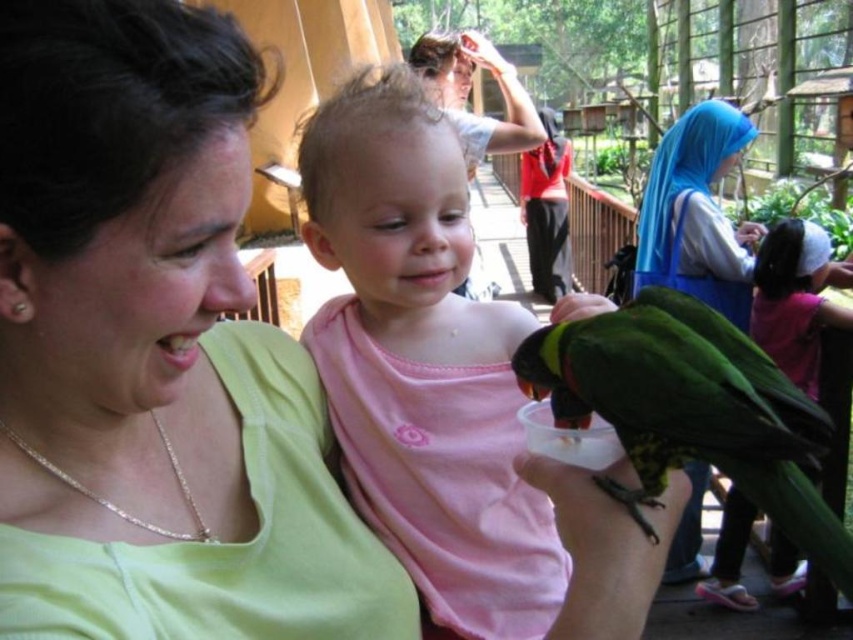
You are a photographer trying to capture a photo of the green matte parrot at lower right. The pink matte shirt at center is blocking your view. Can you estimate if the parrot is shorter than the shirt?

The pink matte shirt at center is taller than green matte parrot at lower right, so yes, the parrot is shorter and might be visible if you adjust your angle to look above the shirt.

You are a fashion designer observing the scene. You notice the matte green shirt at upper left and the pink matte shirt at center. Which shirt do you think is smaller in size?

The matte green shirt at upper left is smaller in size compared to the pink matte shirt at center.

You are a photographer trying to capture the child in the scene. You need to focus on the pink matte shirt at center and the green matte parrot at lower right. Which object should you zoom in on more to ensure both are in focus?

The pink matte shirt at center is bigger than the green matte parrot at lower right, so you should zoom in more on the green matte parrot at lower right to ensure both are in focus.